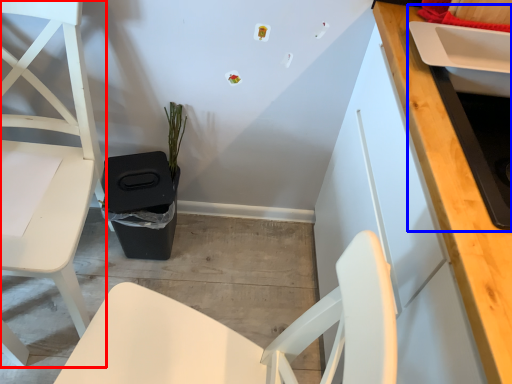
Question: Which point is further to the camera, chair (highlighted by a red box) or sink (highlighted by a blue box)?

Choices:
 (A) chair
 (B) sink

Answer: (A)